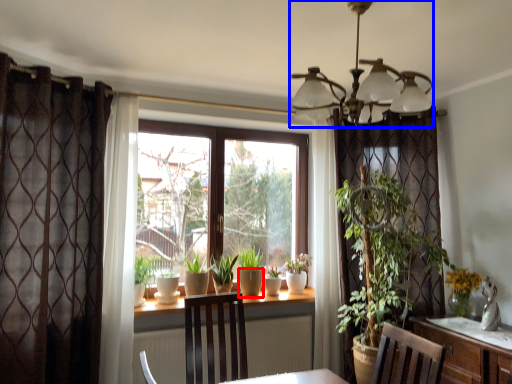
Question: Which point is closer to the camera, flowerpot (highlighted by a red box) or light fixture (highlighted by a blue box)?

Choices:
 (A) flowerpot
 (B) light fixture

Answer: (B)